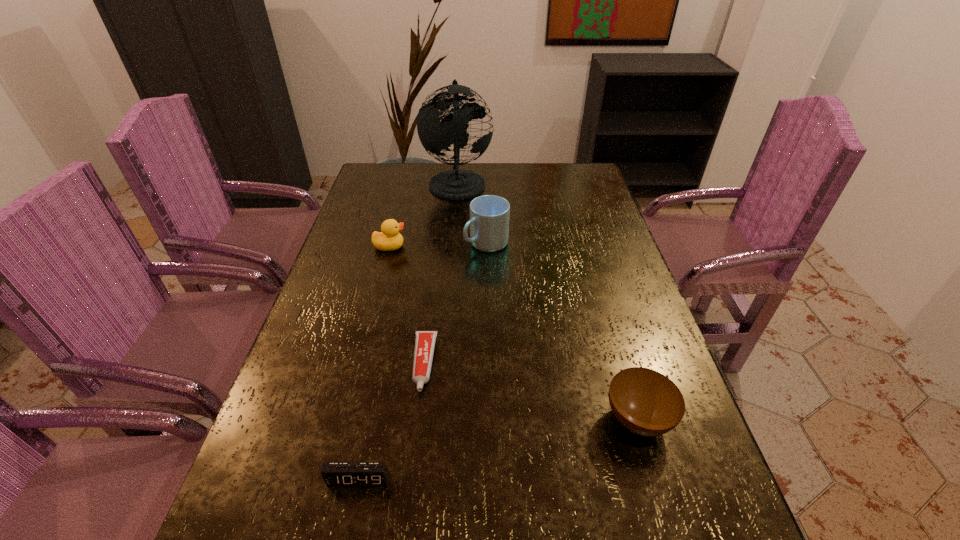
In order to click on vacant point located on the back of the fifth shortest object in this screenshot , I will do `click(486, 218)`.

Where is `free spot located 0.150m at the beak of the duck`? The image size is (960, 540). free spot located 0.150m at the beak of the duck is located at coordinates (457, 246).

Find the location of a particular element. This screenshot has width=960, height=540. vacant space located 0.050m on the front of the fourth tallest object is located at coordinates (x=656, y=479).

Locate an element on the screen. The image size is (960, 540). free location located on the front-facing side of the alarm clock is located at coordinates (348, 531).

Where is `free space located at the nozzle of the toothpaste`? free space located at the nozzle of the toothpaste is located at coordinates (418, 416).

At what (x,y) coordinates should I click in order to perform the action: click on object that is at the far edge. Please return your answer as a coordinate pair (x, y). Image resolution: width=960 pixels, height=540 pixels. Looking at the image, I should click on (435, 136).

Identify the location of duck positioned at the left edge. This screenshot has width=960, height=540. (389, 239).

In order to click on alarm clock located at the left edge in this screenshot , I will do `click(335, 474)`.

I want to click on object at the right edge, so click(x=647, y=403).

In the image, there is a desktop. At what (x,y) coordinates should I click in order to perform the action: click on vacant space at the far edge. Please return your answer as a coordinate pair (x, y). Image resolution: width=960 pixels, height=540 pixels. Looking at the image, I should click on (434, 168).